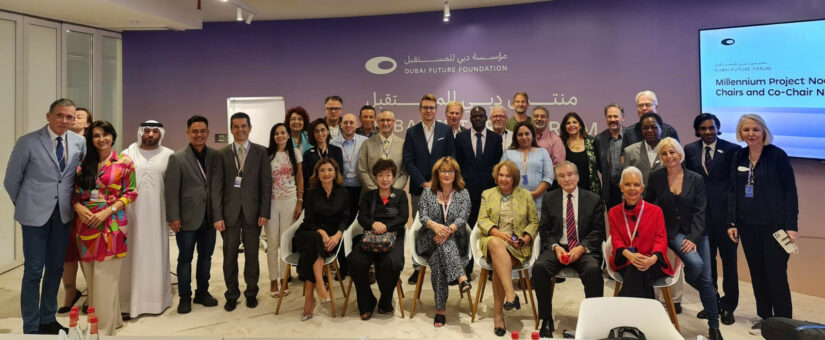
Locate an element on the screen. The height and width of the screenshot is (340, 825). box is located at coordinates (784, 240).